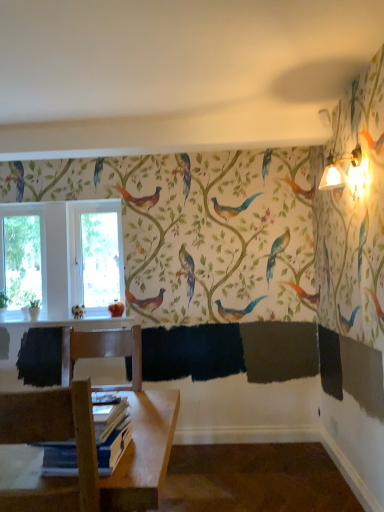
The height and width of the screenshot is (512, 384). What do you see at coordinates (338, 169) in the screenshot?
I see `matte gold sconce at upper right` at bounding box center [338, 169].

You are a GUI agent. You are given a task and a screenshot of the screen. Output one action in this format:
    pyautogui.click(x=<x>, y=<y>)
    Task: Click on the transparent glass window at center, the second window screen positioned from the left
    
    Given the screenshot: What is the action you would take?
    pyautogui.click(x=100, y=259)

The image size is (384, 512). What are the coordinates of `blue paper book at lower left` in the screenshot? It's located at (112, 435).

Based on their sizes in the image, would you say transparent glass window at left, positioned as the first window screen in left-to-right order, is bigger or smaller than wooden chair at lower left?

transparent glass window at left, positioned as the first window screen in left-to-right order, is smaller than wooden chair at lower left.

Is transparent glass window at left, marked as the 2th window screen in a right-to-left arrangement, thinner than wooden chair at lower left?

Yes.

Would you say transparent glass window at left, positioned as the first window screen in left-to-right order, is inside or outside wooden chair at lower left?

transparent glass window at left, positioned as the first window screen in left-to-right order, is not enclosed by wooden chair at lower left.

Considering the sizes of objects transparent glass window at center, the second window screen positioned from the left, and wooden chair at lower left in the image provided, who is taller, transparent glass window at center, the second window screen positioned from the left, or wooden chair at lower left?

transparent glass window at center, the second window screen positioned from the left.

How different are the orientations of transparent glass window at center, the first window screen from the right, and wooden chair at lower left in degrees?

The angle between the facing direction of transparent glass window at center, the first window screen from the right, and the facing direction of wooden chair at lower left is 179 degrees.

From the image's perspective, is transparent glass window at center, the second window screen positioned from the left, located beneath wooden chair at lower left?

No, from the image's perspective, transparent glass window at center, the second window screen positioned from the left, is not beneath wooden chair at lower left.

From the image's perspective, who appears lower, transparent glass window at center, the first window screen from the right, or matte white bird at lower left?

matte white bird at lower left.

Is transparent glass window at center, the first window screen from the right, not close to matte white bird at lower left?

They are positioned close to each other.

Which of these two, transparent glass window at center, the second window screen positioned from the left, or matte white bird at lower left, is bigger?

With larger size is transparent glass window at center, the second window screen positioned from the left.

From a real-world perspective, is transparent glass window at center, the first window screen from the right, physically located above or below matte white bird at lower left?

transparent glass window at center, the first window screen from the right, is above matte white bird at lower left.

You are a GUI agent. You are given a task and a screenshot of the screen. Output one action in this format:
    pyautogui.click(x=<x>, y=<y>)
    Task: Click on the book positioned vertically above the wooden chair at lower left (from a real-world perspective)
    Image resolution: width=384 pixels, height=512 pixels.
    Given the screenshot: What is the action you would take?
    pyautogui.click(x=112, y=435)

From the picture: Is wooden chair at lower left oriented away from blue paper book at lower left?

Yes, wooden chair at lower left is facing away from blue paper book at lower left.

Which is behind, point (100, 407) or point (80, 314)?

The point (80, 314) is farther.

Is blue paper book at lower left located outside matte white bird at lower left?

blue paper book at lower left is positioned outside matte white bird at lower left.

From a real-world perspective, who is located lower, blue paper book at lower left or matte white bird at lower left?

blue paper book at lower left, from a real-world perspective.

Is blue paper book at lower left at the left side of transparent glass window at center, the second window screen positioned from the left?

In fact, blue paper book at lower left is to the right of transparent glass window at center, the second window screen positioned from the left.

How many degrees apart are the facing directions of blue paper book at lower left and transparent glass window at center, the second window screen positioned from the left?

They differ by 0.93 degrees in their facing directions.

Consider the image. Does blue paper book at lower left have a greater height compared to transparent glass window at center, the second window screen positioned from the left?

Incorrect, the height of blue paper book at lower left is not larger of that of transparent glass window at center, the second window screen positioned from the left.

Are blue paper book at lower left and transparent glass window at center, the first window screen from the right, located far from each other?

Yes, blue paper book at lower left and transparent glass window at center, the first window screen from the right, are quite far apart.

Is transparent glass window at center, the second window screen positioned from the left, outside of blue paper book at lower left?

Indeed, transparent glass window at center, the second window screen positioned from the left, is completely outside blue paper book at lower left.

Is transparent glass window at center, the first window screen from the right, beside blue paper book at lower left?

transparent glass window at center, the first window screen from the right, is not next to blue paper book at lower left, and they're not touching.

From the image's perspective, is transparent glass window at center, the second window screen positioned from the left, beneath blue paper book at lower left?

No, from the image's perspective, transparent glass window at center, the second window screen positioned from the left, is not below blue paper book at lower left.

This screenshot has width=384, height=512. I want to click on window screen that is the 1st object located above the wooden chair at lower left (from the image's perspective), so click(x=22, y=259).

This screenshot has width=384, height=512. I want to click on the 1st window screen to the left of the wooden chair at lower left, starting your count from the anchor, so click(100, 259).

When comparing their distances from matte white bird at lower left, does transparent glass window at center, the second window screen positioned from the left, or transparent glass window at left, positioned as the first window screen in left-to-right order, seem further?

The object further to matte white bird at lower left is transparent glass window at left, positioned as the first window screen in left-to-right order.

Estimate the real-world distances between objects in this image. Which object is closer to blue paper book at lower left, wooden chair at lower left or matte gold sconce at upper right?

wooden chair at lower left is closer to blue paper book at lower left.

Which object lies further to the anchor point blue paper book at lower left, wooden chair at lower left or matte white bird at lower left?

matte white bird at lower left lies further to blue paper book at lower left than the other object.

In the scene shown: Looking at the image, which one is located further to matte white bird at lower left, blue paper book at lower left or transparent glass window at center, the second window screen positioned from the left?

blue paper book at lower left lies further to matte white bird at lower left than the other object.

When comparing their distances from blue paper book at lower left, does transparent glass window at left, marked as the 2th window screen in a right-to-left arrangement, or transparent glass window at center, the first window screen from the right, seem further?

transparent glass window at left, marked as the 2th window screen in a right-to-left arrangement, lies further to blue paper book at lower left than the other object.

Based on their spatial positions, is matte white bird at lower left or transparent glass window at center, the second window screen positioned from the left, closer to transparent glass window at left, marked as the 2th window screen in a right-to-left arrangement?

Among the two, transparent glass window at center, the second window screen positioned from the left, is located nearer to transparent glass window at left, marked as the 2th window screen in a right-to-left arrangement.

Considering their positions, is wooden chair at lower left positioned closer to matte gold sconce at upper right than blue paper book at lower left?

blue paper book at lower left.

When comparing their distances from wooden chair at lower left, does matte white bird at lower left or transparent glass window at left, positioned as the first window screen in left-to-right order, seem closer?

matte white bird at lower left.

Find the location of `window screen positioned between blue paper book at lower left and transparent glass window at left, positioned as the first window screen in left-to-right order, from near to far`. window screen positioned between blue paper book at lower left and transparent glass window at left, positioned as the first window screen in left-to-right order, from near to far is located at coordinates (100, 259).

At what (x,y) coordinates should I click in order to perform the action: click on bird between transparent glass window at left, marked as the 2th window screen in a right-to-left arrangement, and transparent glass window at center, the second window screen positioned from the left. Please return your answer as a coordinate pair (x, y). Looking at the image, I should click on (78, 311).

In order to click on bird between blue paper book at lower left and transparent glass window at left, positioned as the first window screen in left-to-right order, from front to back in this screenshot , I will do `click(78, 311)`.

This screenshot has width=384, height=512. Identify the location of window screen between transparent glass window at left, positioned as the first window screen in left-to-right order, and matte gold sconce at upper right. [100, 259].